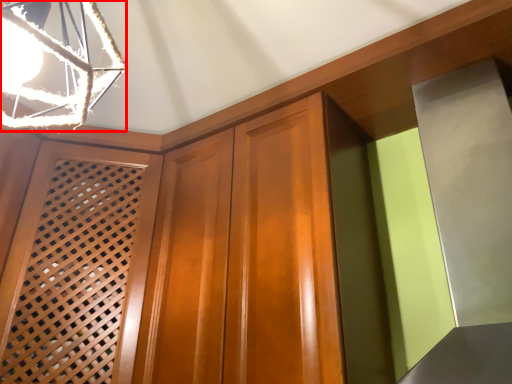
Question: From the image's perspective, what is the correct spatial relationship of lamp (annotated by the red box) in relation to screen door?

Choices:
 (A) above
 (B) below

Answer: (A)